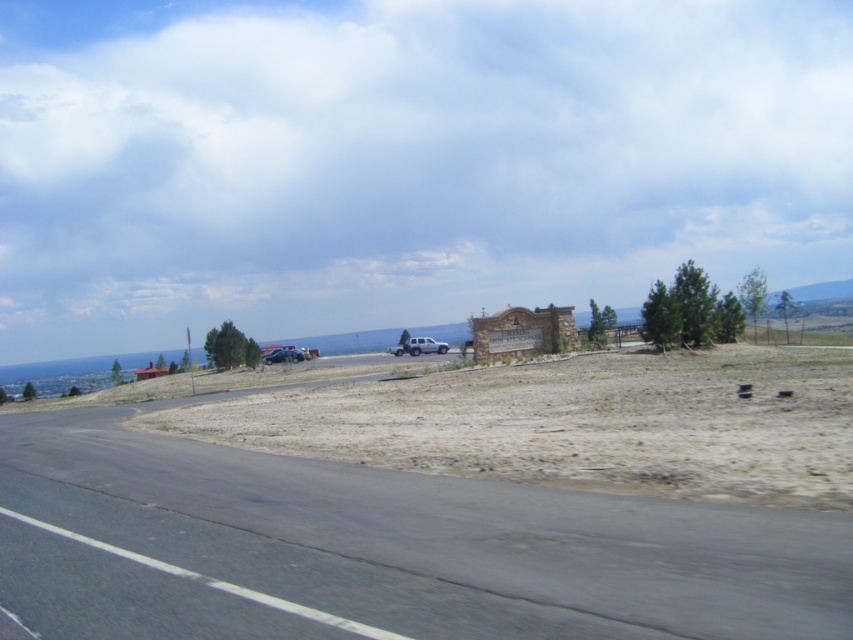
Consider the image. Between silver metallic truck at center and metallic blue truck at center, which one has less height?

metallic blue truck at center is shorter.

This screenshot has height=640, width=853. What do you see at coordinates (418, 346) in the screenshot?
I see `silver metallic truck at center` at bounding box center [418, 346].

Find the location of a particular element. silver metallic truck at center is located at coordinates (418, 346).

Is point (134, 544) closer to viewer compared to point (286, 356)?

Yes, it is.

Who is positioned more to the right, asphalt road at lower left or metallic blue truck at center?

asphalt road at lower left

Find the location of a particular element. The height and width of the screenshot is (640, 853). asphalt road at lower left is located at coordinates (432, 540).

Identify the location of asphalt road at lower left. (432, 540).

Is asphalt road at lower left shorter than silver metallic truck at center?

Correct, asphalt road at lower left is not as tall as silver metallic truck at center.

Is point (723, 512) less distant than point (415, 339)?

Yes, it is.

Does point (384, 502) lie behind point (410, 353)?

That is False.

The height and width of the screenshot is (640, 853). In order to click on asphalt road at lower left in this screenshot , I will do `click(432, 540)`.